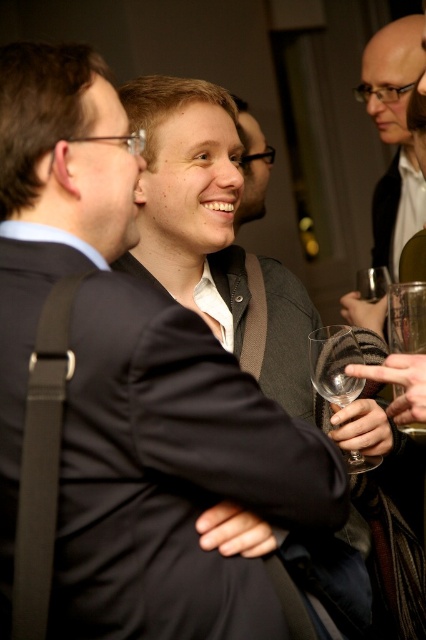
You are a photographer at a formal event. You want to take a closeup photo of the transparent glass wine glass at center without moving the glass. The camera you are using has a minimum focusing distance of 1 meter. Can you take the photo as planned?

The transparent glass wine glass at center and camera are 1.01 meters apart. Since the minimum focusing distance is 1 meter, the camera can focus on the transparent glass wine glass at center because the distance is slightly more than the required minimum.

You are at a formal event and need to decide which item to wear. You have a matte black suit at upper right and a matte black sweater at center. Based on their sizes, which one should you choose if you want something that covers more of your body?

The matte black suit at upper right is taller than the matte black sweater at center, so it would cover more of your body.

You are at a formal event and need to place a decorative item on a table that can only hold items smaller than the matte black suit at upper right. Can the transparent glass wine glass at center be placed there?

The transparent glass wine glass at center is smaller than the matte black suit at upper right, so yes, it can be placed on the table.